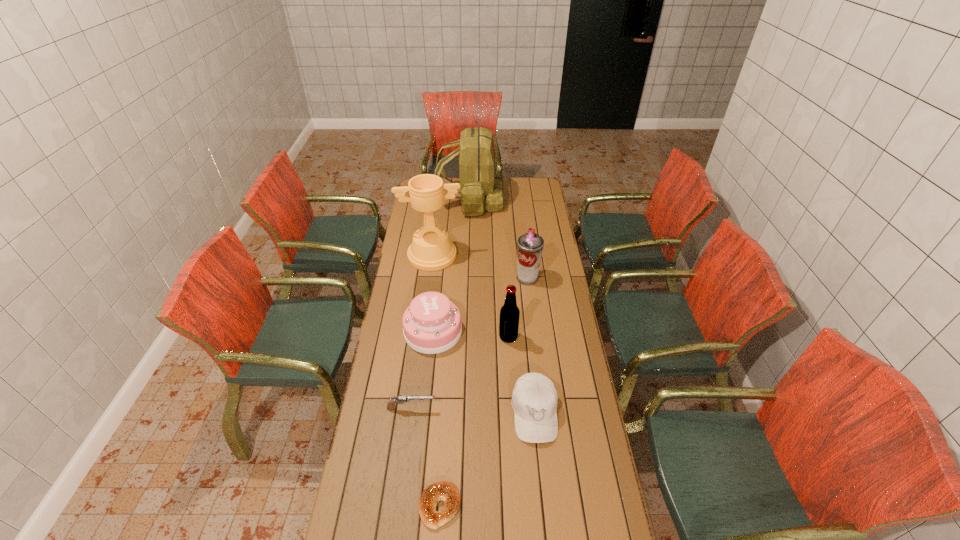
The width and height of the screenshot is (960, 540). Find the location of `vacant space situated on the back of the award`. vacant space situated on the back of the award is located at coordinates (438, 208).

At what (x,y) coordinates should I click in order to perform the action: click on free location located 0.100m on the front of the aerosol can. Please return your answer as a coordinate pair (x, y). Looking at the image, I should click on (530, 302).

Image resolution: width=960 pixels, height=540 pixels. I want to click on vacant space located 0.340m on the back of the beer bottle, so click(x=504, y=275).

Where is `vacant region located 0.260m on the back of the cake`? vacant region located 0.260m on the back of the cake is located at coordinates (440, 271).

Where is `free point located on the front-facing side of the third shortest object`? The height and width of the screenshot is (540, 960). free point located on the front-facing side of the third shortest object is located at coordinates (544, 507).

Find the location of a particular element. free space located aiming along the barrel of the gun is located at coordinates click(x=526, y=408).

Identify the location of free region located 0.130m on the left of the shortest object. (375, 506).

Identify the location of object situated at the far edge. (480, 187).

What are the coordinates of `backpack at the left edge` in the screenshot? It's located at pyautogui.click(x=480, y=187).

Locate an element on the screen. This screenshot has width=960, height=540. award situated at the left edge is located at coordinates (431, 250).